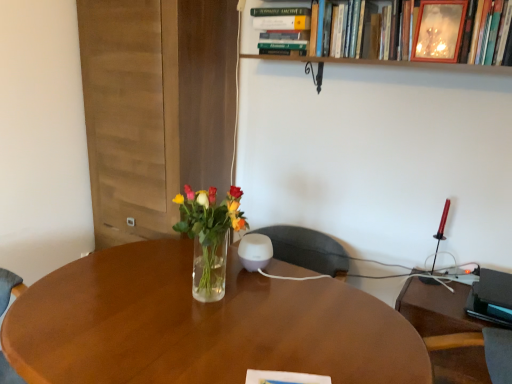
I want to click on vacant area on top of black plastic computer desk at right (from a real-world perspective), so click(446, 296).